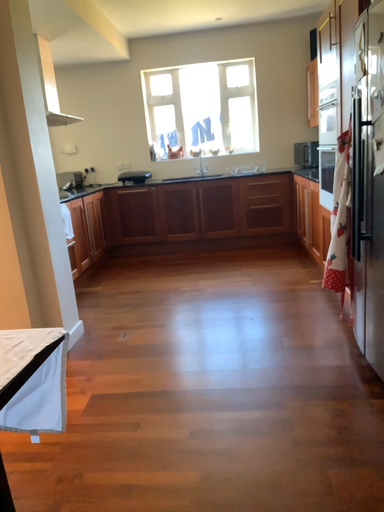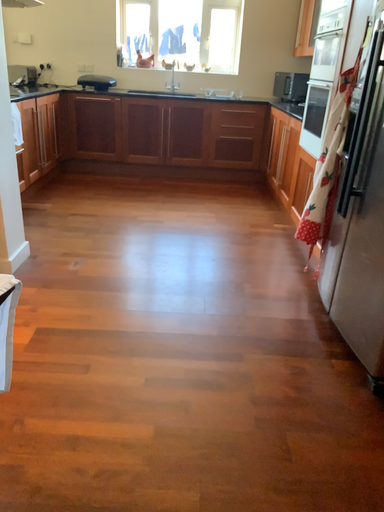
Question: How did the camera likely rotate when shooting the video?

Choices:
 (A) rotated left
 (B) rotated right

Answer: (B)